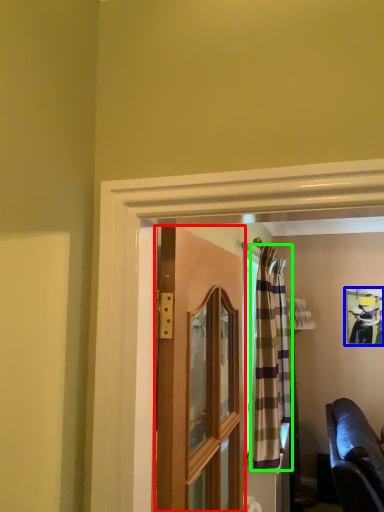
Question: Which object is the farthest from door (highlighted by a red box)? Choose among these: picture frame (highlighted by a blue box) or curtain (highlighted by a green box).

Choices:
 (A) picture frame
 (B) curtain

Answer: (A)